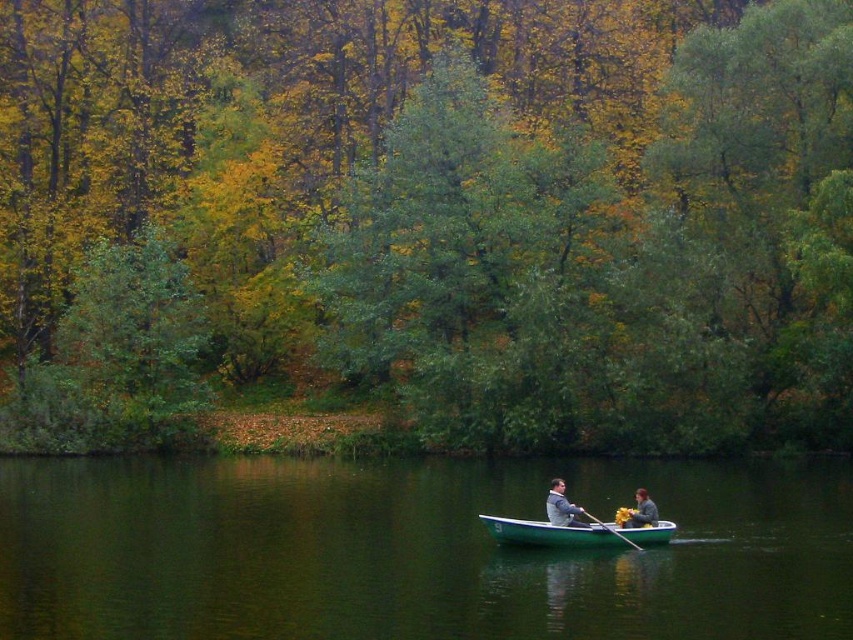
Describe the element at coordinates (561, 506) in the screenshot. I see `gray fabric jacket at lower center` at that location.

Is gray fabric jacket at lower center thinner than wooden smooth paddle at lower center?

Yes, gray fabric jacket at lower center is thinner than wooden smooth paddle at lower center.

This screenshot has height=640, width=853. What do you see at coordinates (561, 506) in the screenshot? I see `gray fabric jacket at lower center` at bounding box center [561, 506].

You are a GUI agent. You are given a task and a screenshot of the screen. Output one action in this format:
    pyautogui.click(x=<x>, y=<y>)
    Task: Click on the gray fabric jacket at lower center
    Image resolution: width=853 pixels, height=640 pixels.
    Given the screenshot: What is the action you would take?
    pyautogui.click(x=561, y=506)

Is green smooth water at center thinner than green plastic canoe at center?

No, green smooth water at center is not thinner than green plastic canoe at center.

Find the location of a particular element. The height and width of the screenshot is (640, 853). green smooth water at center is located at coordinates (412, 552).

Can you confirm if green plastic canoe at center is wider than wooden smooth paddle at lower center?

Correct, the width of green plastic canoe at center exceeds that of wooden smooth paddle at lower center.

Does point (643, 538) lie in front of point (602, 525)?

That is True.

Between point (486, 528) and point (585, 512), which one is positioned in front?

Point (585, 512)

Where is `green plastic canoe at center`? The width and height of the screenshot is (853, 640). green plastic canoe at center is located at coordinates (575, 532).